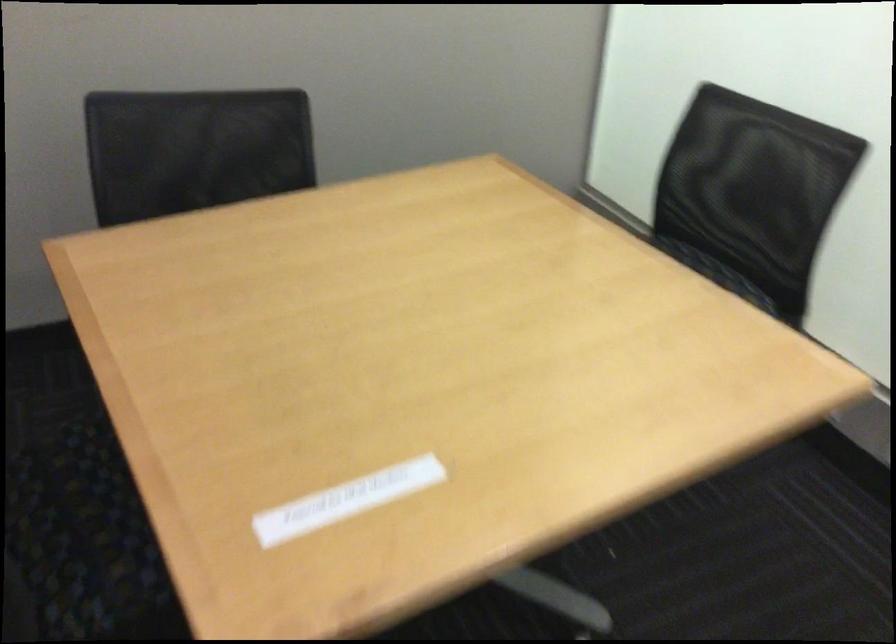
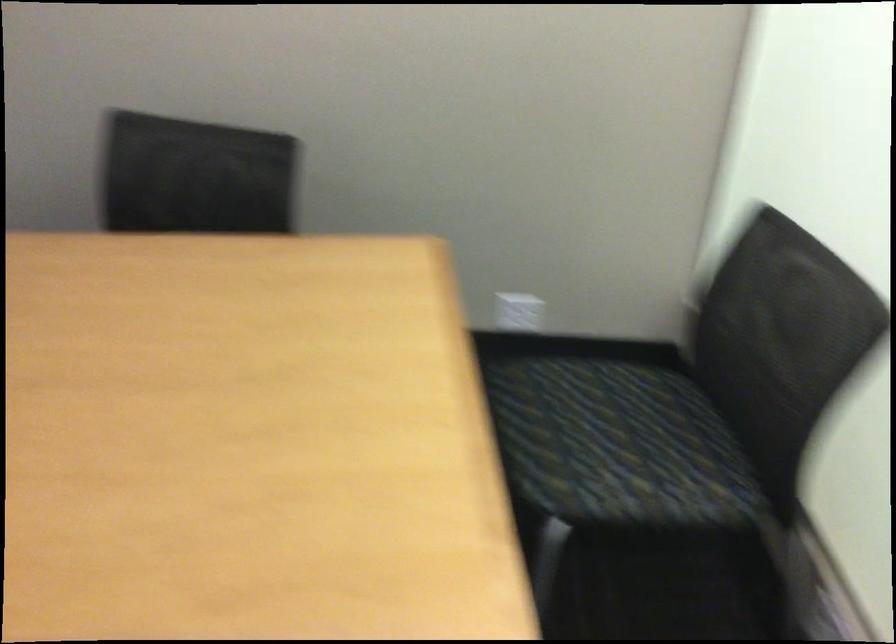
Question: The camera is either moving clockwise (left) or counter-clockwise (right) around the object. The first image is from the beginning of the video and the second image is from the end. Is the camera moving left or right when shooting the video?

Choices:
 (A) Left
 (B) Right

Answer: (B)